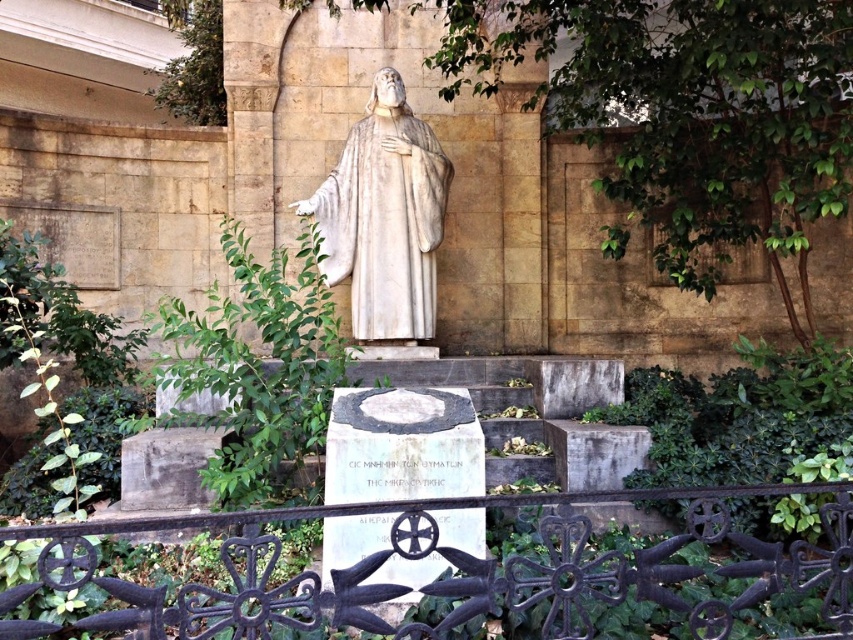
Question: Among these points, which one is nearest to the camera?

Choices:
 (A) (351, 230)
 (B) (747, 538)

Answer: (B)

Question: Can you confirm if black wrought iron fence at lower center is bigger than white marble statue at center?

Choices:
 (A) no
 (B) yes

Answer: (B)

Question: Does black wrought iron fence at lower center appear on the left side of white marble statue at center?

Choices:
 (A) yes
 (B) no

Answer: (B)

Question: Is black wrought iron fence at lower center to the left of white marble statue at center from the viewer's perspective?

Choices:
 (A) no
 (B) yes

Answer: (A)

Question: Which point appears farthest from the camera in this image?

Choices:
 (A) (354, 305)
 (B) (49, 573)

Answer: (A)

Question: Which object appears farthest from the camera in this image?

Choices:
 (A) black wrought iron fence at lower center
 (B) white marble statue at center

Answer: (B)